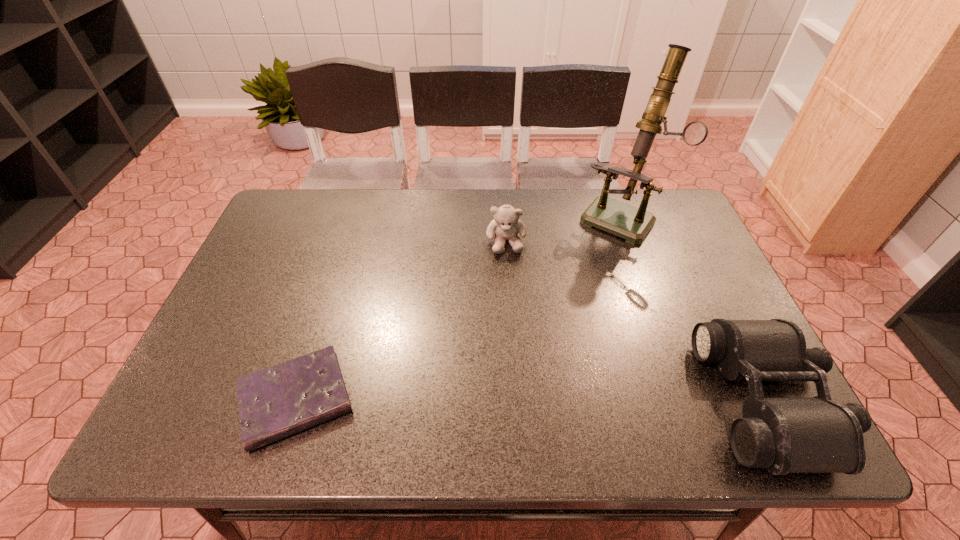
I want to click on object at the near left corner, so click(279, 401).

You are a GUI agent. You are given a task and a screenshot of the screen. Output one action in this format:
    pyautogui.click(x=<x>, y=<y>)
    Task: Click on the object present at the far right corner
    This screenshot has width=960, height=540.
    Given the screenshot: What is the action you would take?
    pyautogui.click(x=626, y=221)

Find the location of a particular element. This screenshot has width=960, height=540. object that is at the near right corner is located at coordinates (783, 435).

Where is `free space at the far edge`? This screenshot has height=540, width=960. free space at the far edge is located at coordinates (450, 218).

This screenshot has height=540, width=960. I want to click on vacant space at the near edge of the desktop, so click(402, 381).

Where is `vacant space at the left edge`? vacant space at the left edge is located at coordinates (254, 296).

In the image, there is a desktop. Identify the location of free space at the right edge. point(657,265).

In the image, there is a desktop. Find the location of `free region at the far left corner`. free region at the far left corner is located at coordinates (319, 200).

Image resolution: width=960 pixels, height=540 pixels. Identify the location of free space between the second object from left to right and the leftmost object. (401, 321).

The height and width of the screenshot is (540, 960). I want to click on free spot between the tallest object and the diary, so click(x=459, y=308).